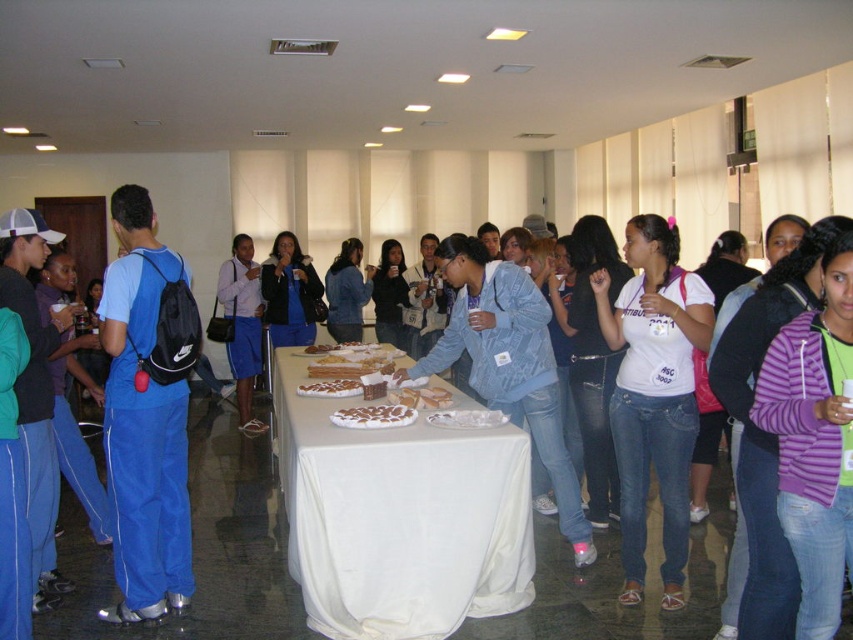
Question: Which of the following is the closest to the observer?

Choices:
 (A) chocolate-coated pastry at center
 (B) white textured cake at center
 (C) white cloth table at center

Answer: (C)

Question: Does chocolate-coated pastry at center appear over white textured cake at center?

Choices:
 (A) no
 (B) yes

Answer: (A)

Question: Among these points, which one is nearest to the camera?

Choices:
 (A) (279, 476)
 (B) (308, 385)

Answer: (B)

Question: Can you confirm if white cloth table at center is positioned to the left of chocolate-coated pastry at center?

Choices:
 (A) no
 (B) yes

Answer: (B)

Question: Is white cloth table at center thinner than white textured cake at center?

Choices:
 (A) no
 (B) yes

Answer: (A)

Question: Which of the following is the farthest from the observer?

Choices:
 (A) white cloth table at center
 (B) chocolate-coated pastry at center

Answer: (B)